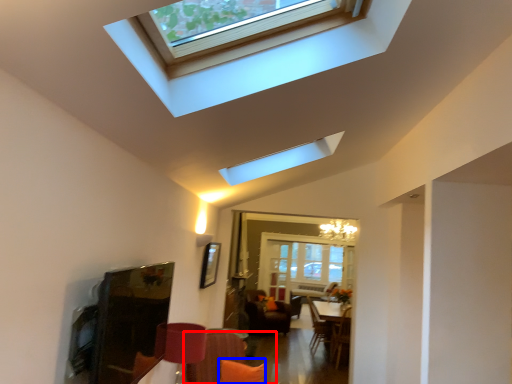
Question: Which object is closer to the camera taking this photo, couch (highlighted by a red box) or pillow (highlighted by a blue box)?

Choices:
 (A) couch
 (B) pillow

Answer: (A)